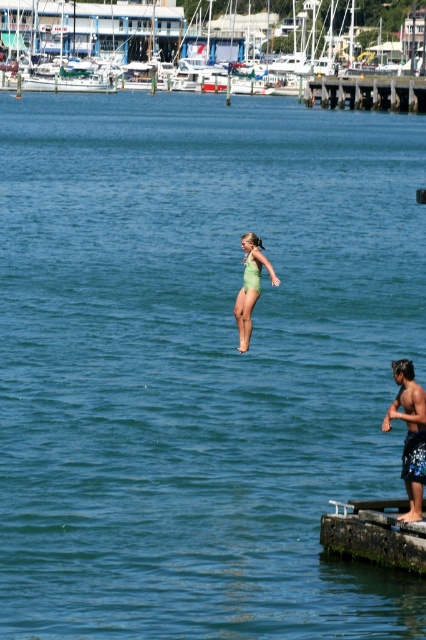
You are standing on the wooden dock and want to jump into the water. There is a green mossy wood dock at lower right and a blue patterned shorts at right. Which object is closer to the water surface?

The green mossy wood dock at lower right is located below blue patterned shorts at right, so it is closer to the water surface.